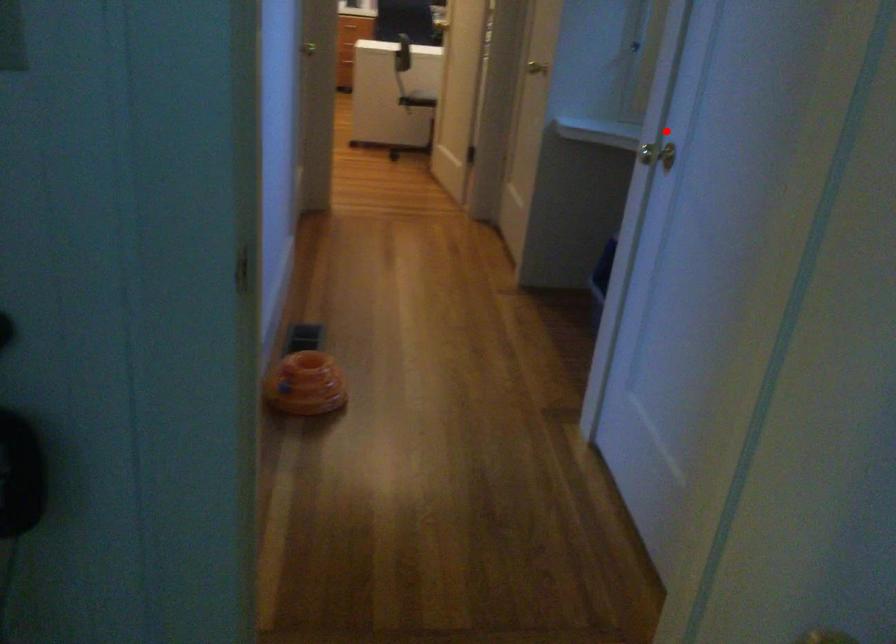
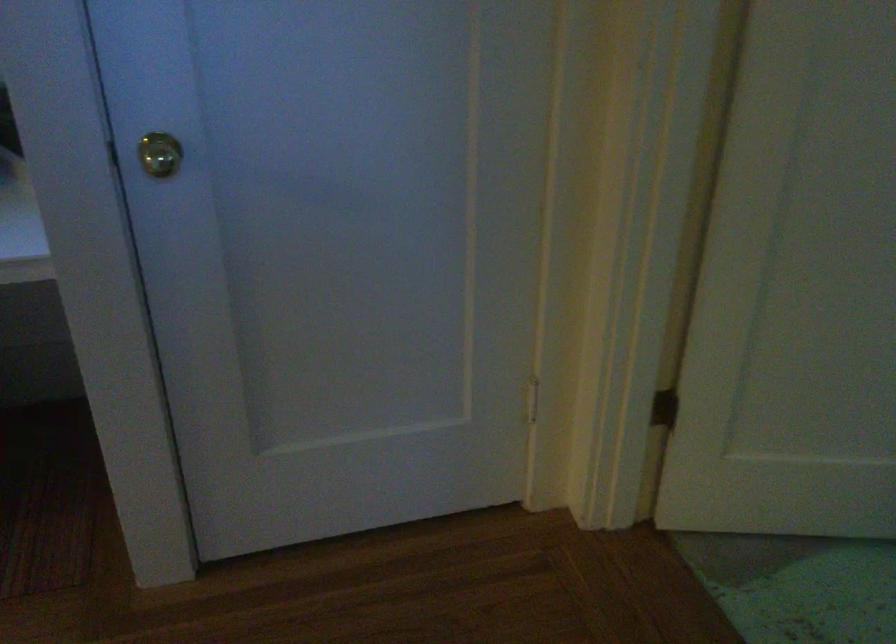
Question: I am providing you with two images of the same scene from different viewpoints. Image1 has a red point marked. In image2, the corresponding 3D location appears at what relative position? Reply with the corresponding letter.

Choices:
 (A) Closer
 (B) Farther

Answer: (A)